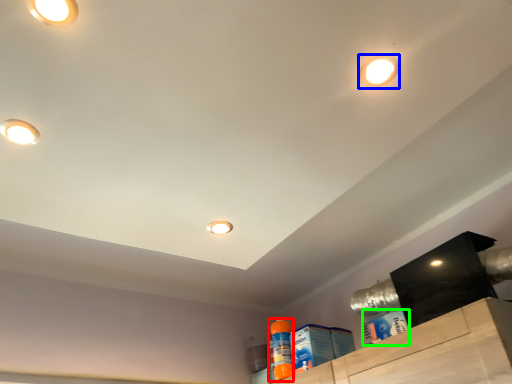
Question: Which object is the closest to the cleaning product (highlighted by a red box)? Choose among these: droplight (highlighted by a blue box) or cleaning product (highlighted by a green box).

Choices:
 (A) droplight
 (B) cleaning product

Answer: (B)